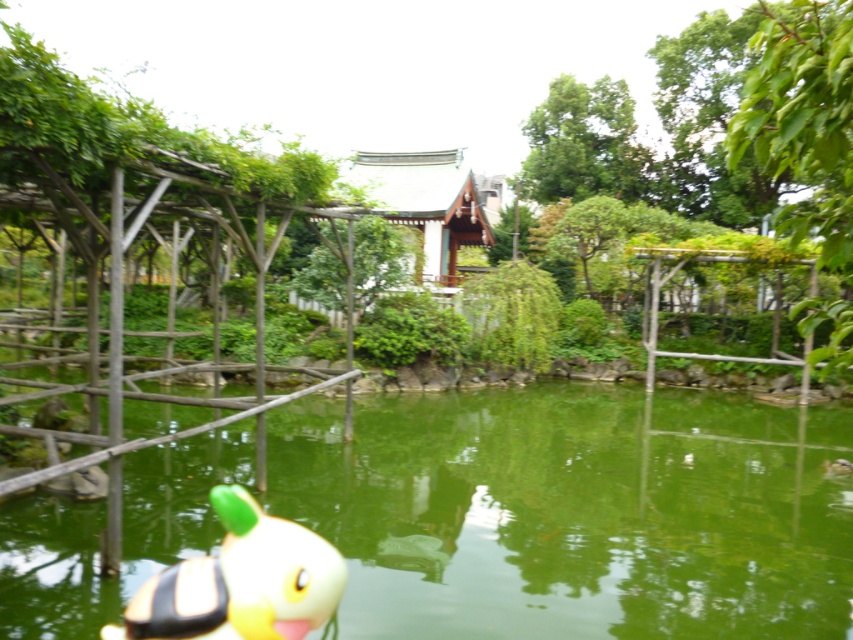
You are standing at the edge of the pond in the garden scene. You want to reach the wooden pergola in the foreground. Which direction should you move relative to the green liquid water at center located at point (573, 512)?

Since the wooden pergola is in the foreground, it is closer to you, so you should move towards the direction opposite of the green liquid water at center located at point (573, 512) to reach it.

You are a gardener who wants to place a new decorative item in the garden. You have a small statue that is 10 cm wide. The statue needs to be placed in an area that is wider than 10 cm. Based on the scene, can the green liquid water at center or the yellow rubber duck at lower left accommodate this statue?

The green liquid water at center might be wider than the yellow rubber duck at lower left, so the statue can be placed in the green liquid water at center if it is wide enough. However, the yellow rubber duck at lower left may not have enough space since it might be narrower.

You are a gardener standing at the edge of the garden and want to place a new decorative item in the pond. The item you have is slightly larger than the yellow rubber duck at lower left. Based on the scene, can you confirm whether there is enough space in the green liquid water at center to accommodate this new item?

The green liquid water at center has a larger size compared to the yellow rubber duck at lower left, so there should be enough space to place the new item as long as it is not significantly larger than the duck.